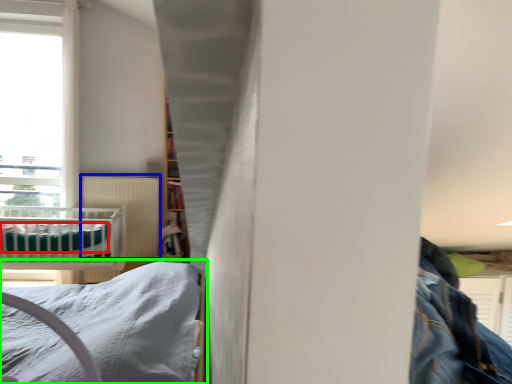
Question: Which object is positioned farthest from sheet (highlighted by a red box)? Select from radiator (highlighted by a blue box) and bed (highlighted by a green box).

Choices:
 (A) radiator
 (B) bed

Answer: (B)